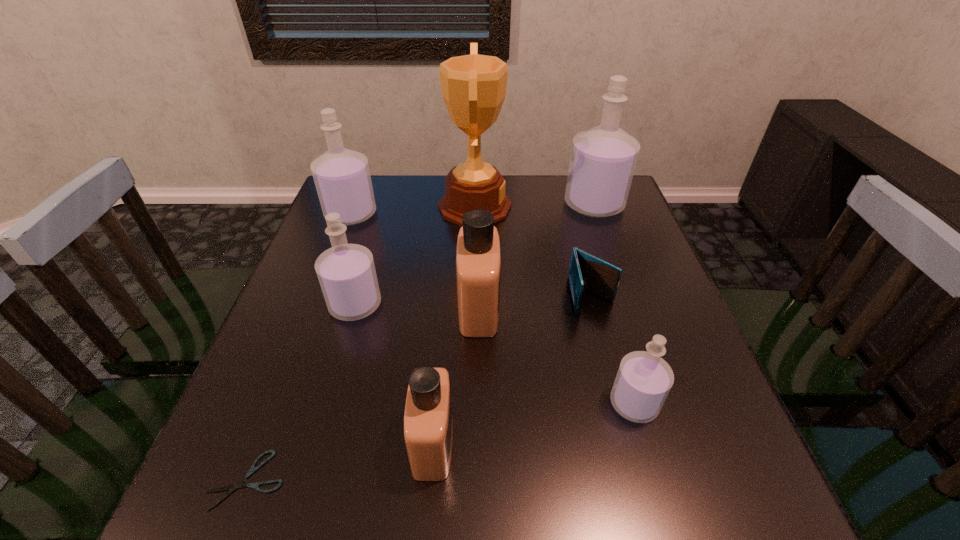
Identify the location of black shears. (231, 488).

The height and width of the screenshot is (540, 960). What are the coordinates of `shears` in the screenshot? It's located at (231, 488).

Identify the location of blank area located 0.150m on the front-facing side of the award. Image resolution: width=960 pixels, height=540 pixels. (563, 206).

Locate an element on the screen. The image size is (960, 540). vacant space positioned on the front of the tallest perfume is located at coordinates (626, 295).

Locate an element on the screen. The image size is (960, 540). vacant space located 0.380m on the right of the third tallest object is located at coordinates (511, 214).

Where is `vacant space located 0.140m on the right of the second smallest purple perfume`? This screenshot has width=960, height=540. vacant space located 0.140m on the right of the second smallest purple perfume is located at coordinates (444, 305).

Image resolution: width=960 pixels, height=540 pixels. I want to click on free spot located on the front label of the farther beige perfume, so click(598, 308).

I want to click on blank space located 0.070m on the front of the smallest purple perfume, so click(652, 465).

I want to click on free spot located on the front label of the nearer beige perfume, so click(536, 443).

At what (x,y) coordinates should I click in order to perform the action: click on free space located on the exterior surface of the wallet. Please return your answer as a coordinate pair (x, y). The height and width of the screenshot is (540, 960). Looking at the image, I should click on (649, 512).